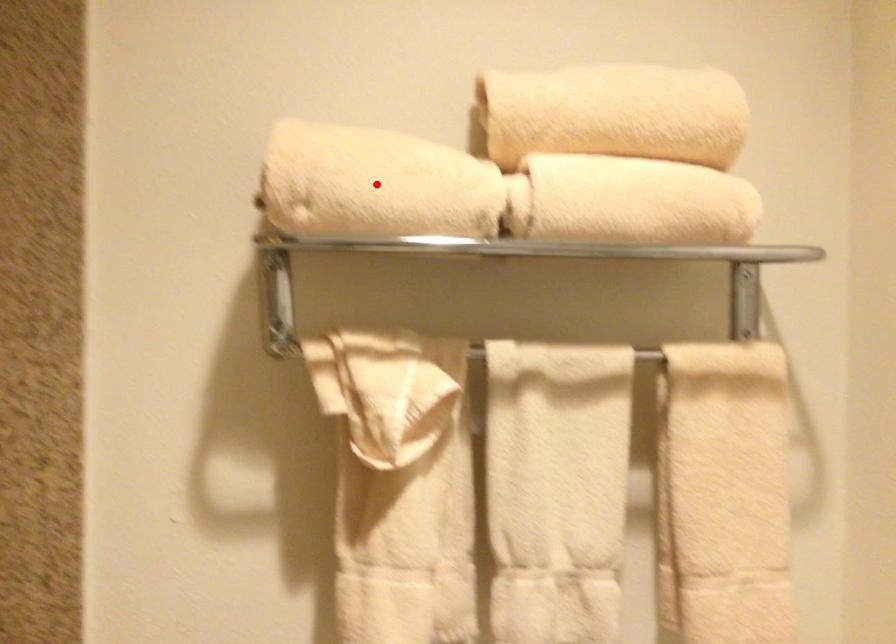
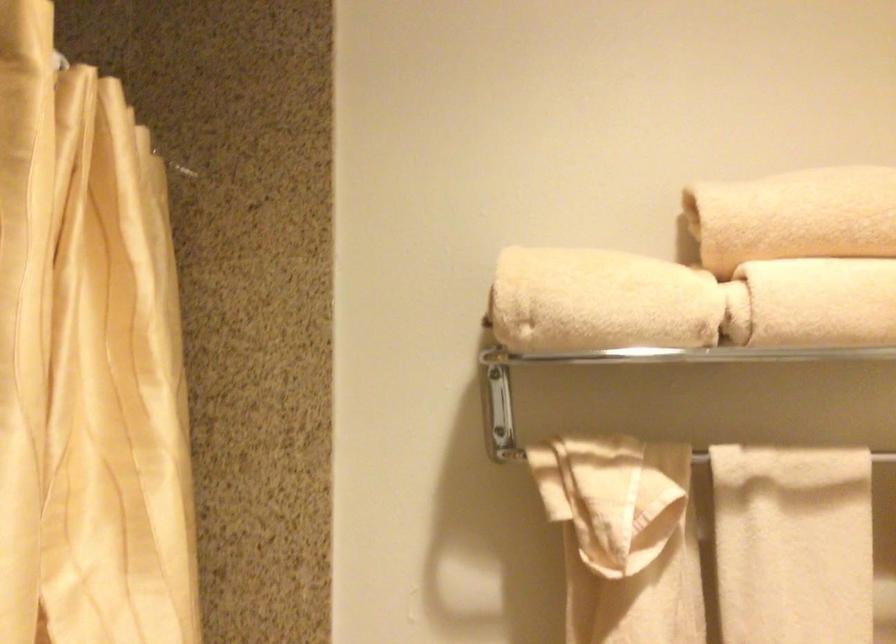
Where in the second image is the point corresponding to the highlighted location from the first image?

(599, 301)